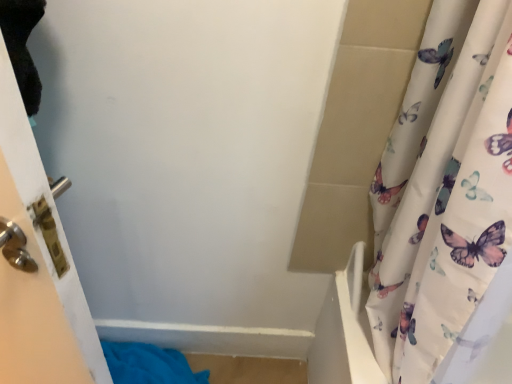
Question: Looking at their shapes, would you say white glossy door at left is wider or thinner than blue fabric towel at lower left?

Choices:
 (A) wide
 (B) thin

Answer: (A)

Question: In the image, is white glossy door at left positioned in front of or behind blue fabric towel at lower left?

Choices:
 (A) behind
 (B) front

Answer: (B)

Question: In terms of height, does white glossy door at left look taller or shorter compared to blue fabric towel at lower left?

Choices:
 (A) short
 (B) tall

Answer: (B)

Question: Considering the positions of blue fabric towel at lower left and white glossy door at left in the image, is blue fabric towel at lower left wider or thinner than white glossy door at left?

Choices:
 (A) wide
 (B) thin

Answer: (B)

Question: Is blue fabric towel at lower left in front of or behind white glossy door at left in the image?

Choices:
 (A) behind
 (B) front

Answer: (A)

Question: From a real-world perspective, is blue fabric towel at lower left above or below white glossy door at left?

Choices:
 (A) below
 (B) above

Answer: (A)

Question: In terms of size, does blue fabric towel at lower left appear bigger or smaller than white glossy door at left?

Choices:
 (A) big
 (B) small

Answer: (B)